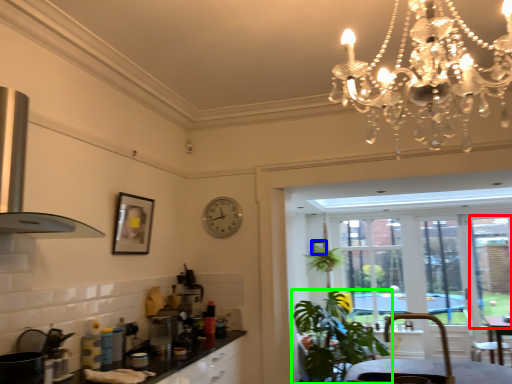
Question: Which object is positioned farthest from window screen (highlighted by a red box)? Select from picture frame (highlighted by a blue box) and houseplant (highlighted by a green box).

Choices:
 (A) picture frame
 (B) houseplant

Answer: (B)